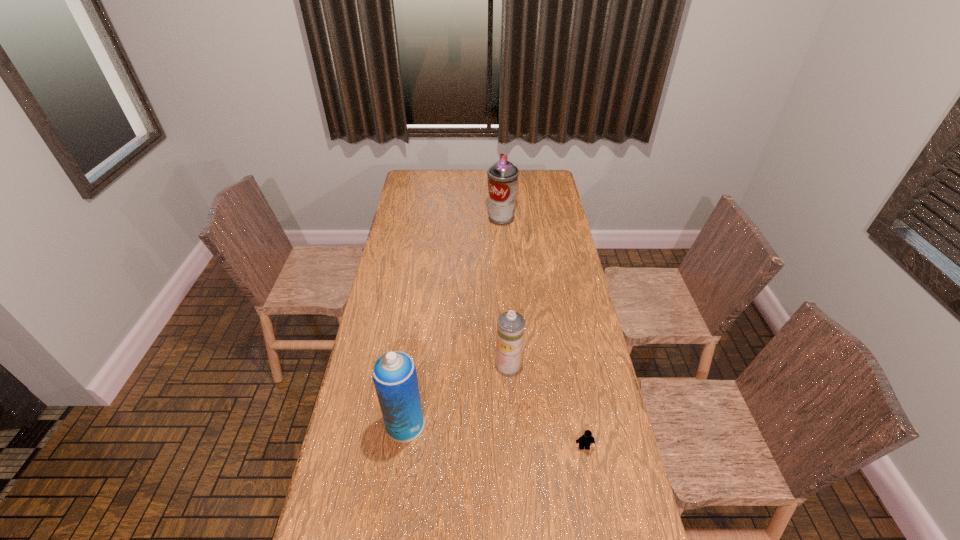
The width and height of the screenshot is (960, 540). Identify the location of free space between the Lego and the nearest aerosol can. (494, 436).

At what (x,y) coordinates should I click in order to perform the action: click on vacant space that is in between the nearest aerosol can and the farthest aerosol can. Please return your answer as a coordinate pair (x, y). The image size is (960, 540). Looking at the image, I should click on (453, 321).

In order to click on free space between the farthest object and the shortest object in this screenshot , I will do `click(542, 333)`.

The width and height of the screenshot is (960, 540). I want to click on vacant region between the shortest object and the farthest object, so click(x=542, y=333).

Identify the location of vacant area that lies between the second nearest aerosol can and the farthest object. (505, 291).

You are a GUI agent. You are given a task and a screenshot of the screen. Output one action in this format:
    pyautogui.click(x=<x>, y=<y>)
    Task: Click on the object that is the third nearest to the farthest object
    The image size is (960, 540).
    Given the screenshot: What is the action you would take?
    pyautogui.click(x=586, y=439)

Locate an element on the screen. This screenshot has height=540, width=960. object that is the third closest to the second farthest aerosol can is located at coordinates (502, 176).

Identify which aerosol can is the second nearest to the second nearest aerosol can. Please provide its 2D coordinates. Your answer should be formatted as a tuple, i.e. [(x, y)], where the tuple contains the x and y coordinates of a point satisfying the conditions above.

[(502, 176)]

Locate which aerosol can ranks in proximity to the third farthest object. Please provide its 2D coordinates. Your answer should be formatted as a tuple, i.e. [(x, y)], where the tuple contains the x and y coordinates of a point satisfying the conditions above.

[(510, 326)]

The image size is (960, 540). In order to click on vacant space that satisfies the following two spatial constraints: 1. on the back side of the nearest aerosol can; 2. on the right side of the shortest aerosol can in this screenshot , I will do `click(413, 364)`.